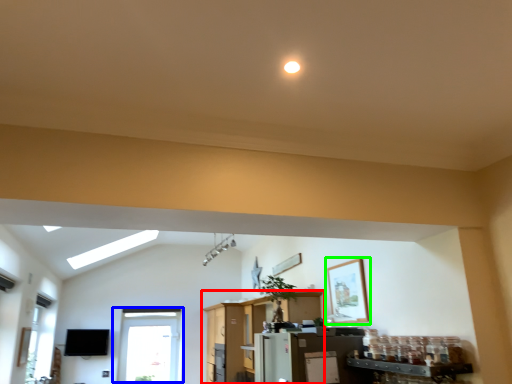
Question: Considering the real-world distances, which object is closest to entertainment center (highlighted by a red box)? window (highlighted by a blue box) or picture frame (highlighted by a green box).

Choices:
 (A) window
 (B) picture frame

Answer: (A)